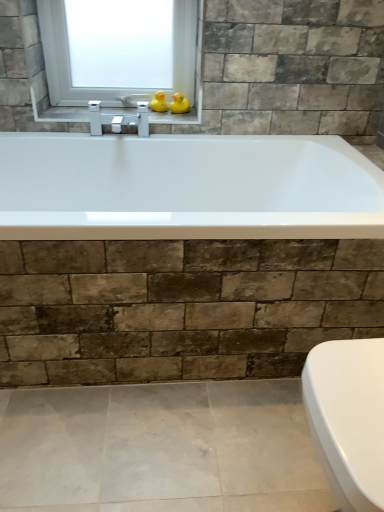
The height and width of the screenshot is (512, 384). Identify the location of free location to the left of rubber duck at upper center, the first duck in the left-to-right sequence. (114, 115).